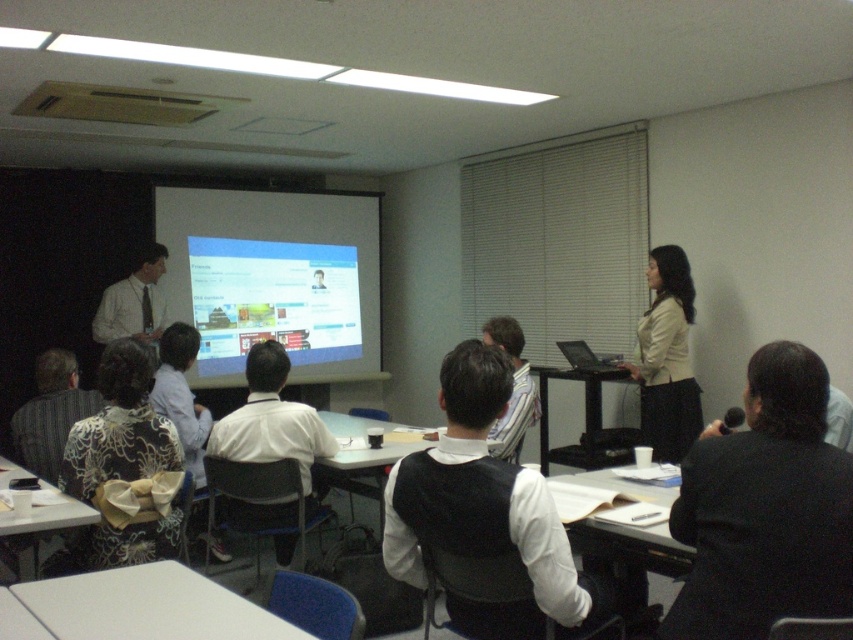
You are attending a presentation in the classroom and need to place a laptop on the table closest to you. Is the white glossy table at lower center located directly below the striped fabric shirt at center?

Yes, the white glossy table at lower center is positioned under striped fabric shirt at center, so placing the laptop there would place it directly below the shirt.

You are a person sitting at the back of the classroom. You want to place your laptop on the white plastic table at center and the striped fabric shirt at center. Which one can you place your laptop on?

The white plastic table at center has a greater height compared to striped fabric shirt at center, so you can place your laptop on the white plastic table at center.

You are standing at the entrance of the classroom and want to place a laptop on the white plastic table at center. Can you walk directly to the table without moving any chairs?

The white plastic table at center is located at point (361, 468), so yes, you can walk directly to the table without needing to move any chairs as its position allows unobstructed access.